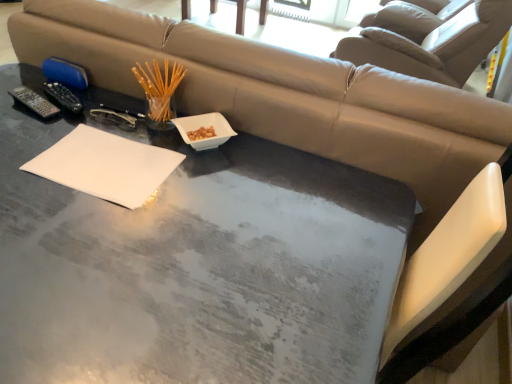
The height and width of the screenshot is (384, 512). I want to click on vacant space behind white matte notepad at center, so click(x=119, y=119).